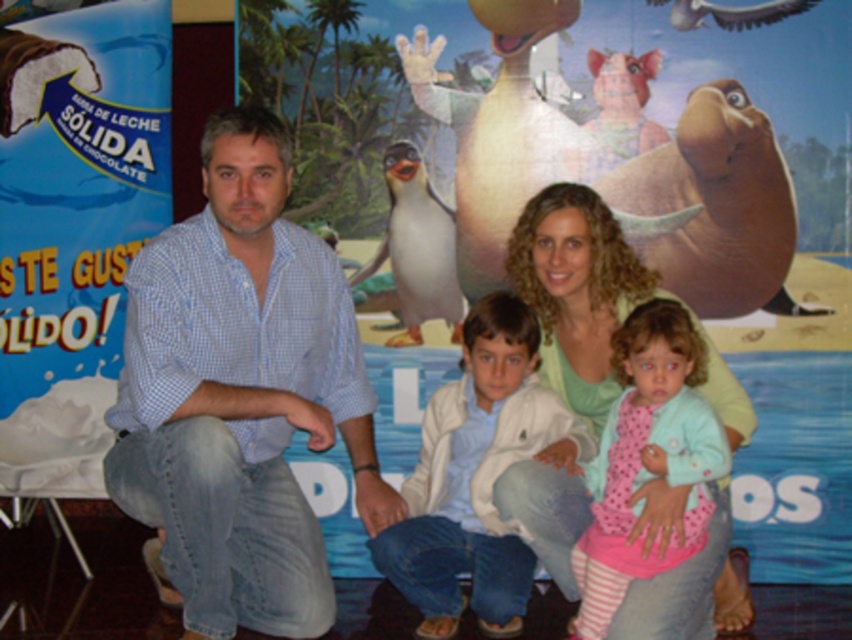
Question: Which object is positioned farthest from the blue checkered shirt at left?

Choices:
 (A) white cotton shirt at center
 (B) pink striped fabric at center
 (C) light blue checkered shirt at center

Answer: (C)

Question: Can you confirm if white cotton shirt at center is thinner than pink striped fabric at center?

Choices:
 (A) yes
 (B) no

Answer: (B)

Question: Which object is closer to the camera taking this photo?

Choices:
 (A) light blue checkered shirt at center
 (B) pink striped fabric at center
 (C) blue checkered shirt at left
 (D) white cotton shirt at center

Answer: (C)

Question: Among these points, which one is nearest to the camera?

Choices:
 (A) (614, 550)
 (B) (354, 424)

Answer: (A)

Question: Does blue checkered shirt at left lie behind light blue checkered shirt at center?

Choices:
 (A) yes
 (B) no

Answer: (B)

Question: Does blue checkered shirt at left have a greater width compared to light blue checkered shirt at center?

Choices:
 (A) no
 (B) yes

Answer: (B)